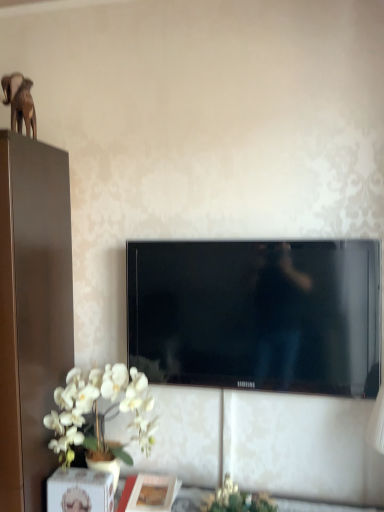
Question: Considering the positions of green leafy plant at lower center and brown matte elephant at upper left in the image, is green leafy plant at lower center taller or shorter than brown matte elephant at upper left?

Choices:
 (A) tall
 (B) short

Answer: (B)

Question: Considering the positions of green leafy plant at lower center and brown matte elephant at upper left in the image, is green leafy plant at lower center wider or thinner than brown matte elephant at upper left?

Choices:
 (A) thin
 (B) wide

Answer: (B)

Question: Considering the real-world distances, which object is closest to the matte white picture frame at lower center?

Choices:
 (A) brown matte elephant at upper left
 (B) green leafy plant at lower center
 (C) black glossy tv at center
 (D) white matte orchid at lower left

Answer: (B)

Question: Based on their relative distances, which object is farther from the matte white picture frame at lower center?

Choices:
 (A) black glossy tv at center
 (B) white matte orchid at lower left
 (C) green leafy plant at lower center
 (D) brown matte elephant at upper left

Answer: (D)